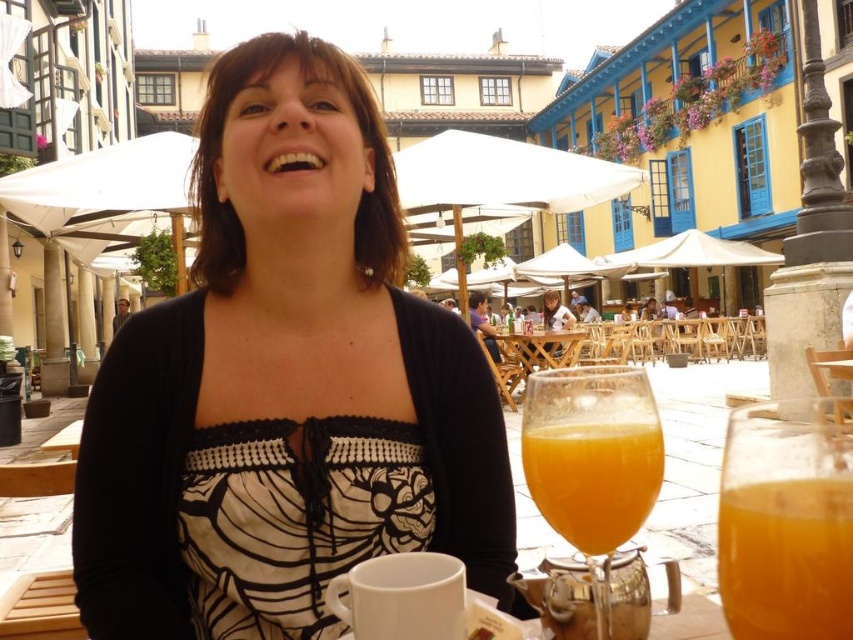
Is point (515, 369) in front of point (550, 304)?

Yes, it is.

Which of these two, wooden table at center or matte black dress at center, stands shorter?

With less height is wooden table at center.

The image size is (853, 640). Identify the location of wooden table at center. (537, 353).

Between translucent glass at lower center and matte black dress at center, which one is positioned lower?

translucent glass at lower center

Between point (566, 488) and point (549, 291), which one is positioned behind?

Positioned behind is point (549, 291).

This screenshot has width=853, height=640. Find the location of `translucent glass at lower center`. translucent glass at lower center is located at coordinates (593, 480).

Can you confirm if translucent glass at lower center is positioned to the right of wooden table at center?

In fact, translucent glass at lower center is to the left of wooden table at center.

Is point (593, 500) in front of point (523, 371)?

Yes.

Who is more forward, (538, 484) or (538, 364)?

Point (538, 484) is in front.

Image resolution: width=853 pixels, height=640 pixels. I want to click on translucent glass at lower center, so coord(593,480).